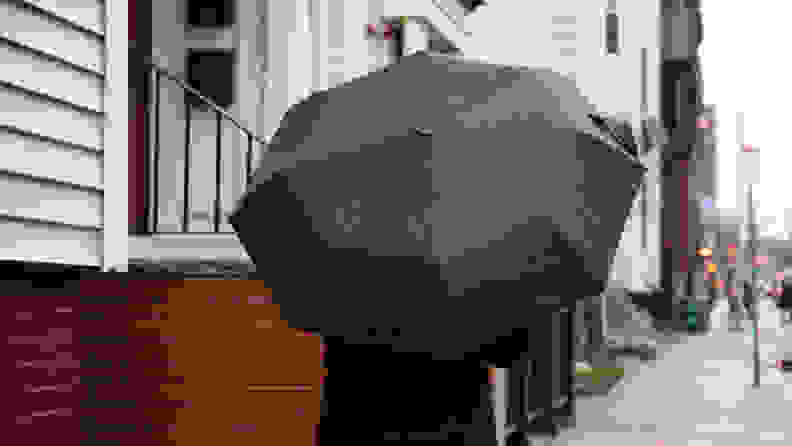
You are a GUI agent. You are given a task and a screenshot of the screen. Output one action in this format:
    pyautogui.click(x=<x>, y=<y>)
    Task: Click on the door
    The image size is (792, 446).
    Given the screenshot: What is the action you would take?
    pyautogui.click(x=166, y=33)